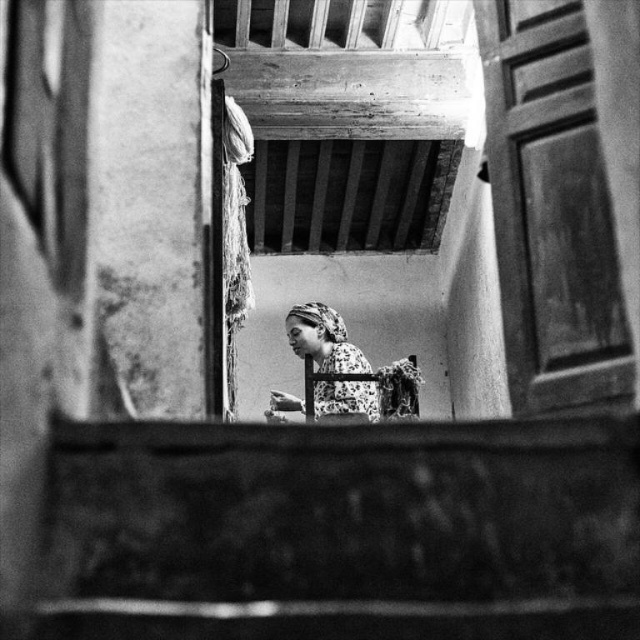
You are standing at the entrance of the room and want to go down the smooth concrete stairs at lower center. Based on the coordinates provided, in which direction should you walk to reach the stairs?

The smooth concrete stairs at lower center are located at coordinates point [342,531], so you should walk towards the lower center direction to reach them.

You are standing at the entrance of the room and want to approach the woman sitting on the chair. Which object, the smooth concrete stairs at lower center or the floral fabric headscarf at center, would you encounter first as you move towards her?

You would encounter the smooth concrete stairs at lower center first because it is closer to you than the floral fabric headscarf at center, which is further away.